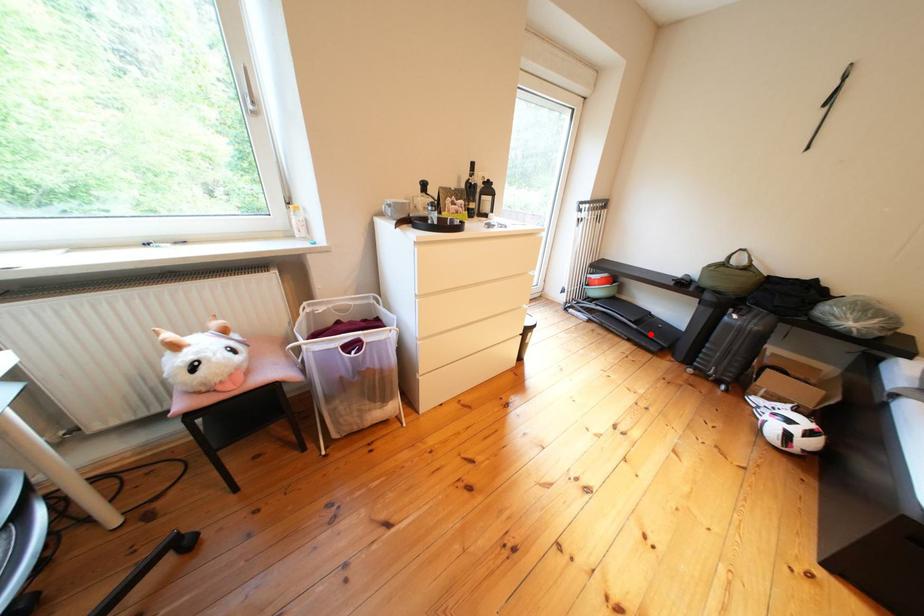
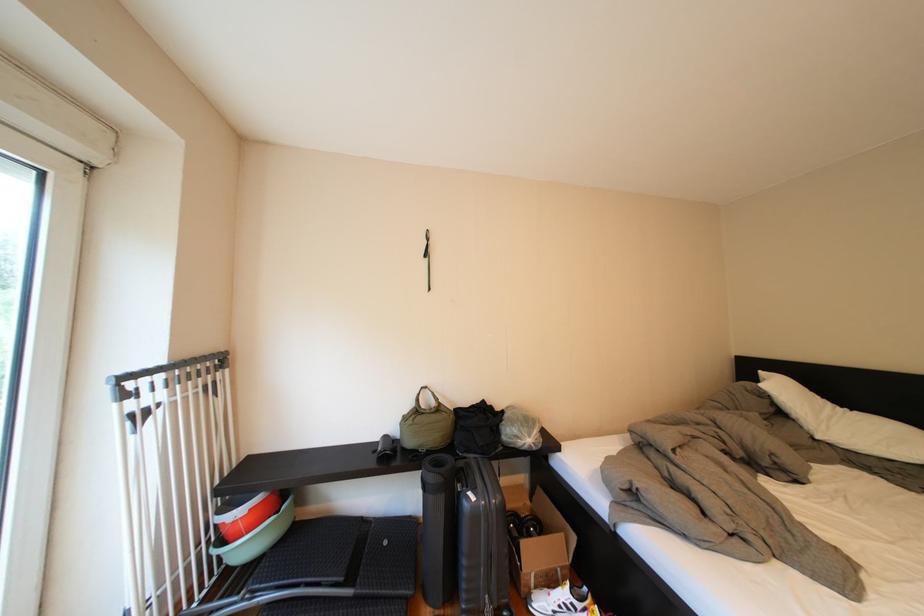
Question: I am providing you with two images of the same scene from different viewpoints. Image1 has a red point marked. In image2, the corresponding 3D location appears at what relative position? Reply with the corresponding letter.

Choices:
 (A) Closer
 (B) Farther

Answer: (B)